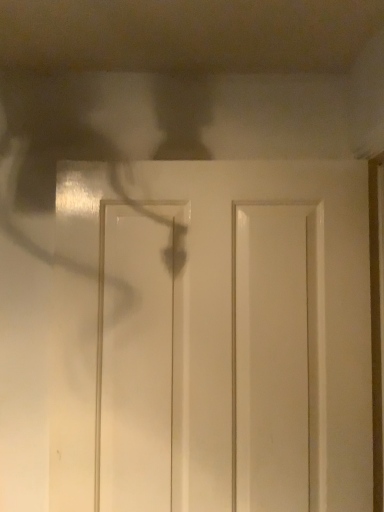
In order to click on white matte door at center in this screenshot , I will do `click(308, 322)`.

The height and width of the screenshot is (512, 384). Describe the element at coordinates (308, 322) in the screenshot. I see `white matte door at center` at that location.

Find the location of a particular element. Image resolution: width=384 pixels, height=512 pixels. white matte door at center is located at coordinates (308, 322).